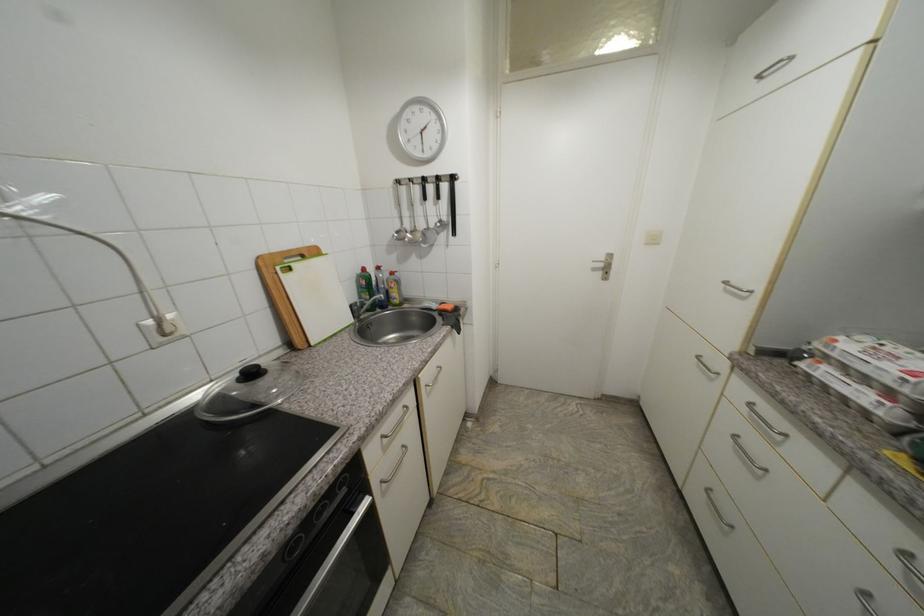
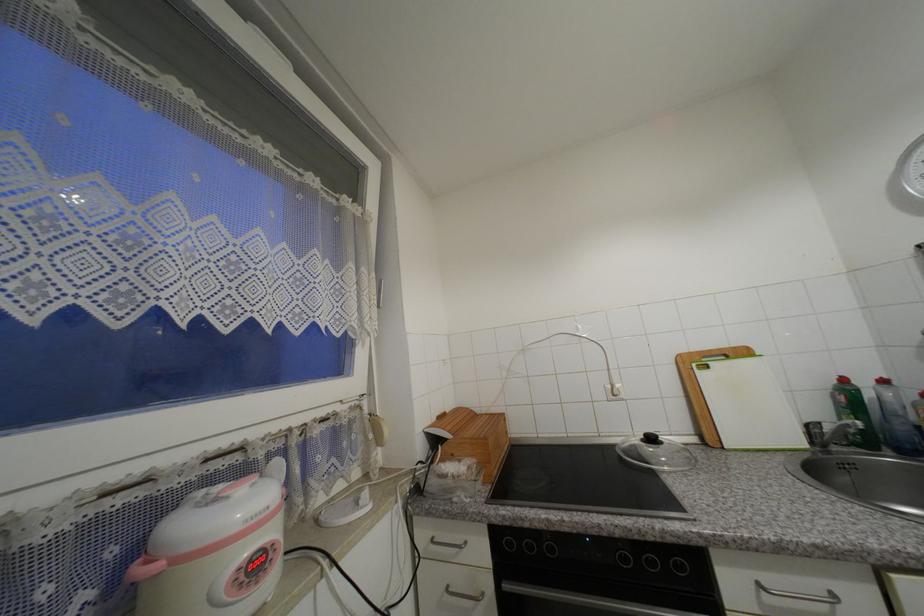
Find the pixel in the second image that matches the point at 370,270 in the first image.

(849, 381)